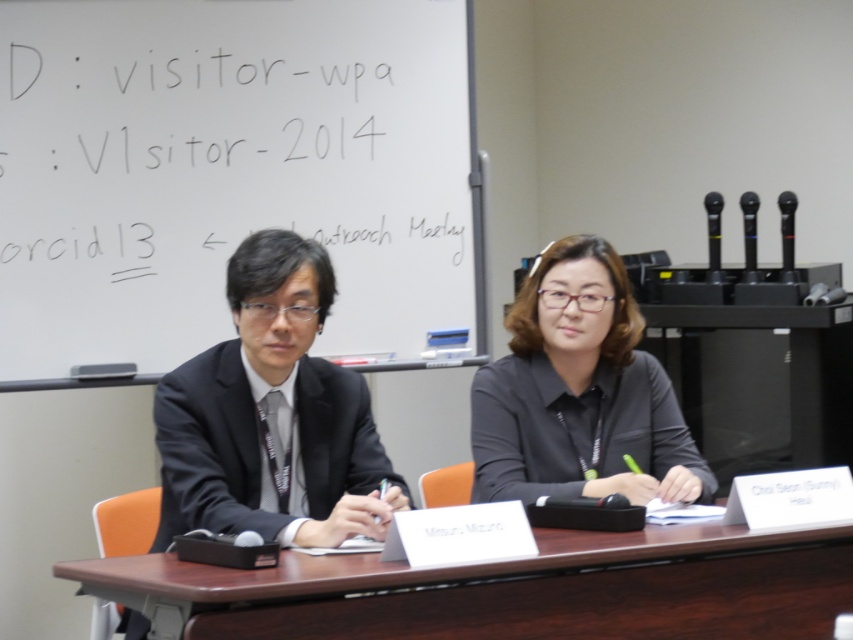
You are standing at the entrance of the conference room and see the point marked at coordinates (271,416). Which object does this point correspond to?

The point at coordinates (271,416) corresponds to the black suit at center.

You are standing in front of the meeting table where two people are seated. You need to write something on the whiteboard at upper left. Can you reach it without moving your position?

The whiteboard at upper left is 9.80 feet away from you, so you can reach it without moving your position if you can stretch that far, but typically, 9.80 feet is quite a distance to reach comfortably. It might be better to take a step closer.